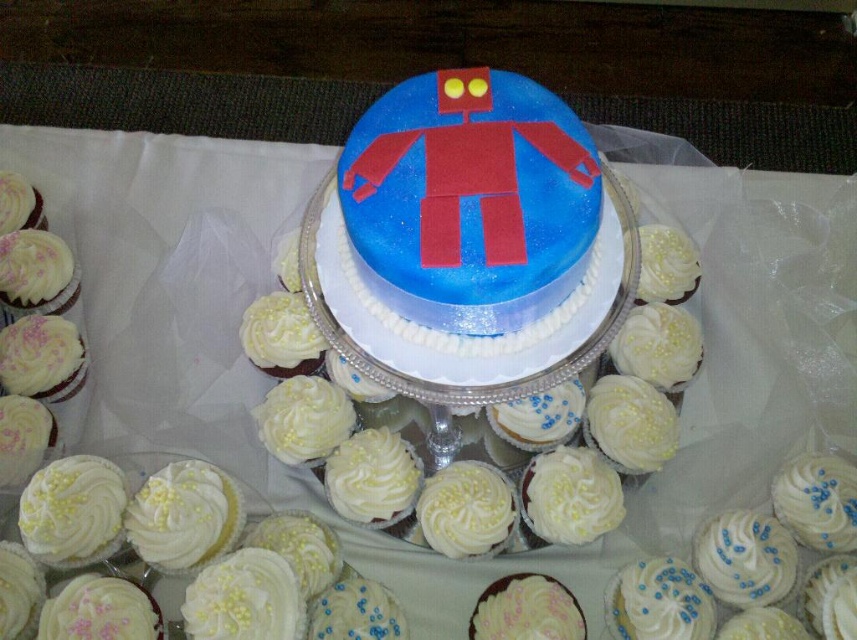
Who is more distant from viewer, (528, 340) or (513, 595)?

Positioned behind is point (513, 595).

Can you confirm if blue fondant robot at center is shorter than white frosted cupcake at center?

No.

Does point (531, 138) lie behind point (564, 632)?

That is False.

The height and width of the screenshot is (640, 857). Find the location of `blue fondant robot at center`. blue fondant robot at center is located at coordinates (470, 209).